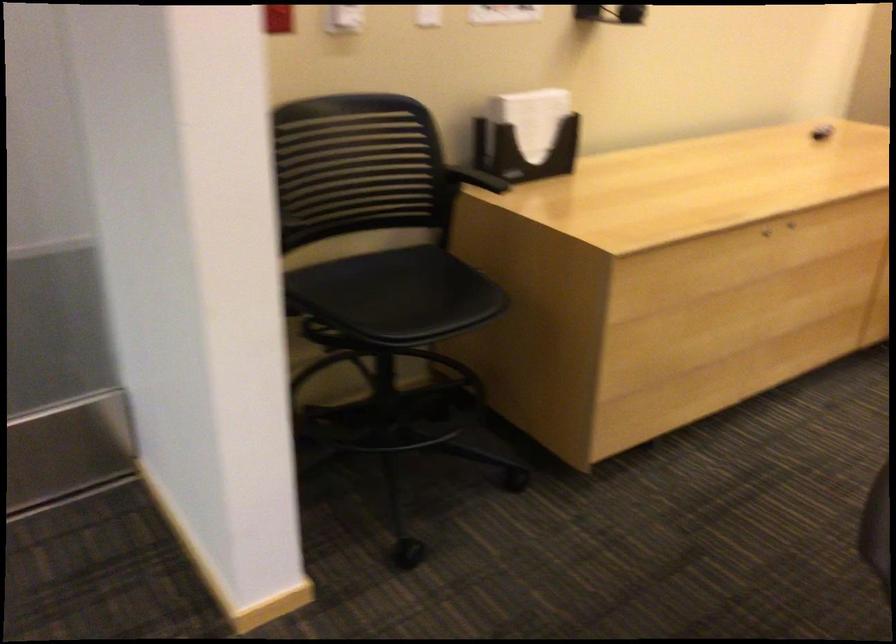
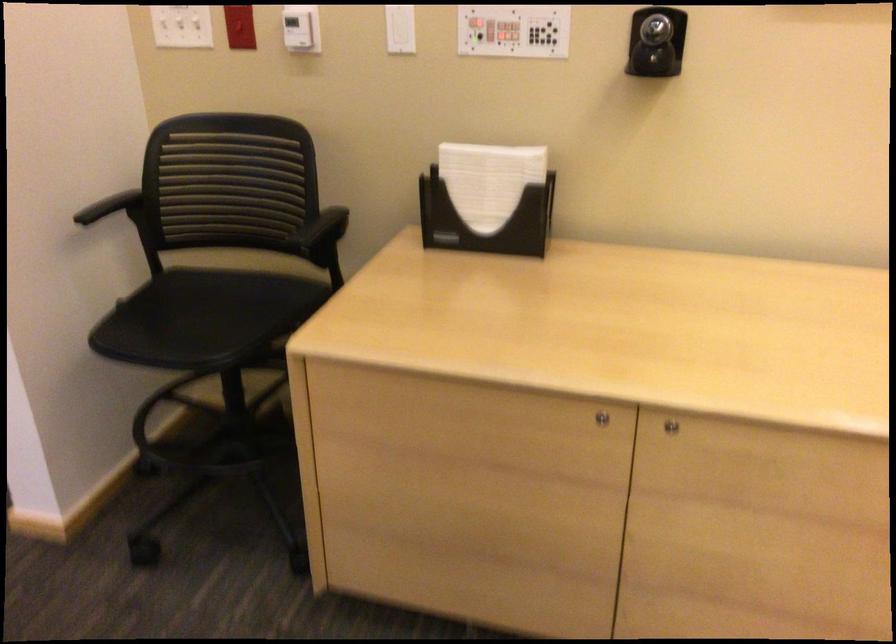
Find the pixel in the second image that matches point 535,114 in the first image.

(488, 180)